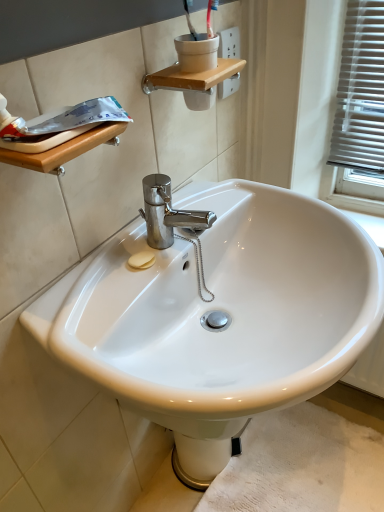
You are a GUI agent. You are given a task and a screenshot of the screen. Output one action in this format:
    pyautogui.click(x=<x>, y=<y>)
    Task: Click on the white glossy sink at center
    
    Given the screenshot: What is the action you would take?
    pyautogui.click(x=221, y=311)

What do you see at coordinates (221, 311) in the screenshot? The height and width of the screenshot is (512, 384). I see `white glossy sink at center` at bounding box center [221, 311].

Measure the distance between white glossy sink at center and camera.

They are 20.31 inches apart.

Where is `white glossy sink at center`? Image resolution: width=384 pixels, height=512 pixels. white glossy sink at center is located at coordinates (221, 311).